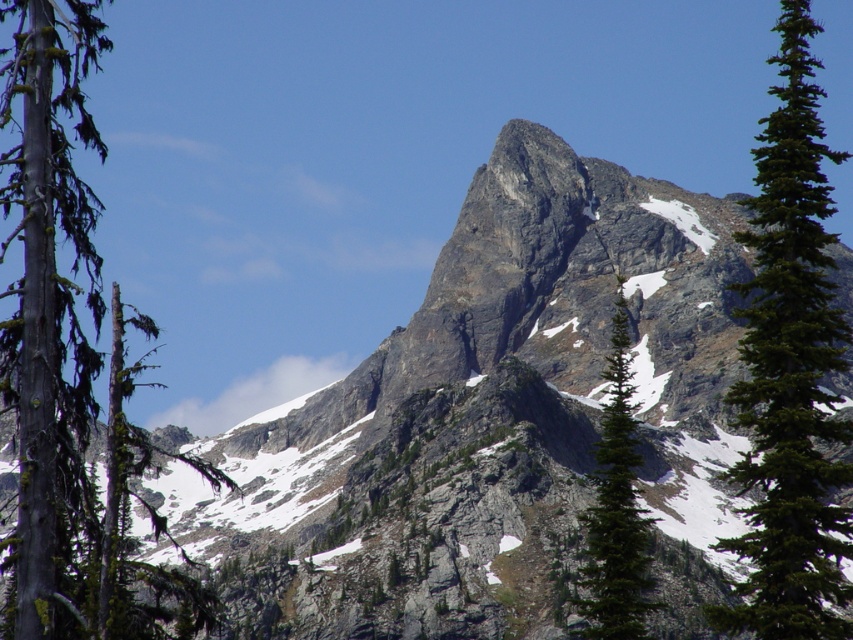
Which is below, green mossy tree trunk at left or green textured pine tree at center?

Positioned lower is green textured pine tree at center.

Does point (186, 621) come closer to viewer compared to point (619, 337)?

No, it is behind (619, 337).

At what (x,y) coordinates should I click in order to perform the action: click on green mossy tree trunk at left. Please return your answer as a coordinate pair (x, y). This screenshot has height=640, width=853. Looking at the image, I should click on (70, 358).

Between green coniferous tree at right and green textured pine tree at center, which one has less height?

green textured pine tree at center is shorter.

Is the position of green coniferous tree at right more distant than that of green textured pine tree at center?

That is False.

Between point (809, 618) and point (621, 586), which one is positioned behind?

The point (621, 586) is more distant.

Where is `green coniferous tree at right`? green coniferous tree at right is located at coordinates (790, 371).

Is green mossy tree trunk at left shorter than green coniferous tree at right?

In fact, green mossy tree trunk at left may be taller than green coniferous tree at right.

Between point (74, 500) and point (817, 602), which one is positioned behind?

Positioned behind is point (74, 500).

Locate an element on the screen. green mossy tree trunk at left is located at coordinates (70, 358).